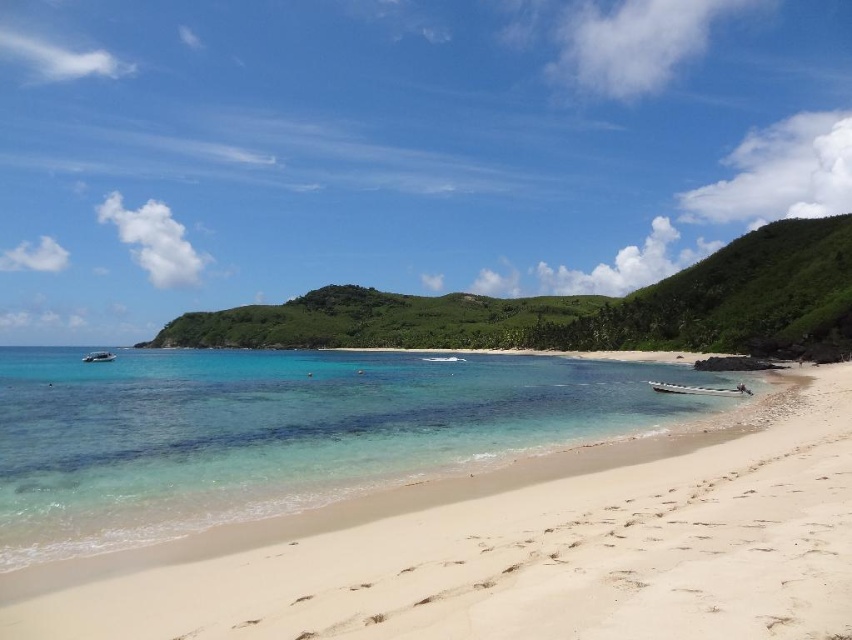
Question: In this image, where is green leafy island at center located relative to white glossy boat at left?

Choices:
 (A) below
 (B) above

Answer: (B)

Question: Which point appears farthest from the camera in this image?

Choices:
 (A) (112, 358)
 (B) (653, 627)
 (C) (695, 285)

Answer: (C)

Question: Which of the following is the farthest from the observer?

Choices:
 (A) green leafy island at center
 (B) white glossy boat at left

Answer: (B)

Question: In this image, where is white sandy beach at lower left located relative to green leafy island at center?

Choices:
 (A) above
 (B) below

Answer: (B)

Question: From the image, what is the correct spatial relationship of green leafy island at center in relation to white glossy boat at left?

Choices:
 (A) right
 (B) left

Answer: (A)

Question: Among these objects, which one is nearest to the camera?

Choices:
 (A) white sandy beach at lower left
 (B) green leafy island at center

Answer: (A)